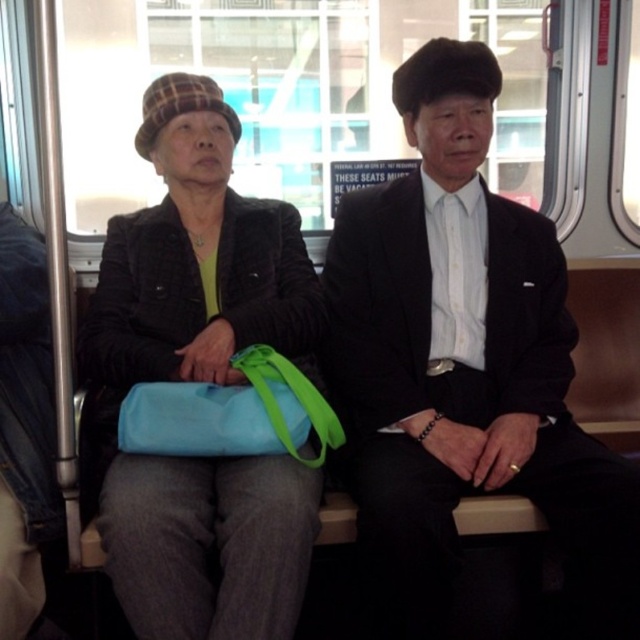
You are a passenger on a train and need to store your belongings in the overhead compartment. The overhead compartment has a width of 40 cm. You have the black smooth suit at center and the blue fabric bag at center with you. Based on their sizes, which item can fit into the overhead compartment without exceeding its width?

The blue fabric bag at center can fit into the overhead compartment since the black smooth suit at center is wider than the blue fabric bag at center, and the compartment is 40 cm wide.

You are a passenger on a train and want to place your backpack on the floor near the matte black jacket at center. Can you estimate where to place it based on the coordinates provided?

The matte black jacket at center is located at coordinates (195,259). Place your backpack near these coordinates on the floor.